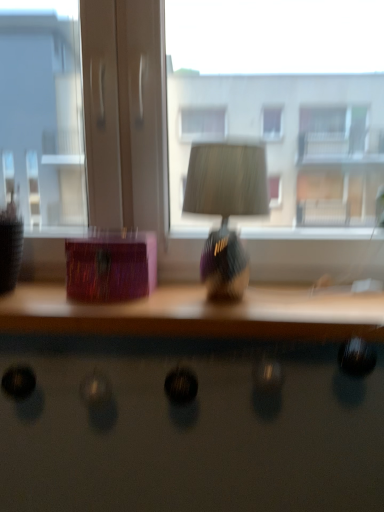
Question: Is shiny black desk at lower center to the right of shiny purple lampshade at center from the viewer's perspective?

Choices:
 (A) no
 (B) yes

Answer: (A)

Question: Considering the relative sizes of shiny black desk at lower center and shiny purple lampshade at center in the image provided, is shiny black desk at lower center shorter than shiny purple lampshade at center?

Choices:
 (A) no
 (B) yes

Answer: (B)

Question: Can you confirm if shiny black desk at lower center is taller than shiny purple lampshade at center?

Choices:
 (A) no
 (B) yes

Answer: (A)

Question: From a real-world perspective, does shiny black desk at lower center sit lower than shiny purple lampshade at center?

Choices:
 (A) yes
 (B) no

Answer: (A)

Question: Is shiny black desk at lower center in front of shiny purple lampshade at center?

Choices:
 (A) no
 (B) yes

Answer: (B)

Question: Would you say shiny black desk at lower center is outside shiny purple lampshade at center?

Choices:
 (A) no
 (B) yes

Answer: (B)

Question: Is shiny black desk at lower center turned away from transparent glass window at center?

Choices:
 (A) no
 (B) yes

Answer: (A)

Question: From the image's perspective, is shiny black desk at lower center above transparent glass window at center?

Choices:
 (A) no
 (B) yes

Answer: (A)

Question: Can you confirm if shiny black desk at lower center is smaller than transparent glass window at center?

Choices:
 (A) yes
 (B) no

Answer: (A)

Question: Is shiny black desk at lower center thinner than transparent glass window at center?

Choices:
 (A) no
 (B) yes

Answer: (B)

Question: Does shiny black desk at lower center lie in front of transparent glass window at center?

Choices:
 (A) yes
 (B) no

Answer: (A)

Question: Is the surface of shiny black desk at lower center in direct contact with transparent glass window at center?

Choices:
 (A) no
 (B) yes

Answer: (A)

Question: Is the depth of shiny purple lampshade at center greater than that of shiny black desk at lower center?

Choices:
 (A) yes
 (B) no

Answer: (A)